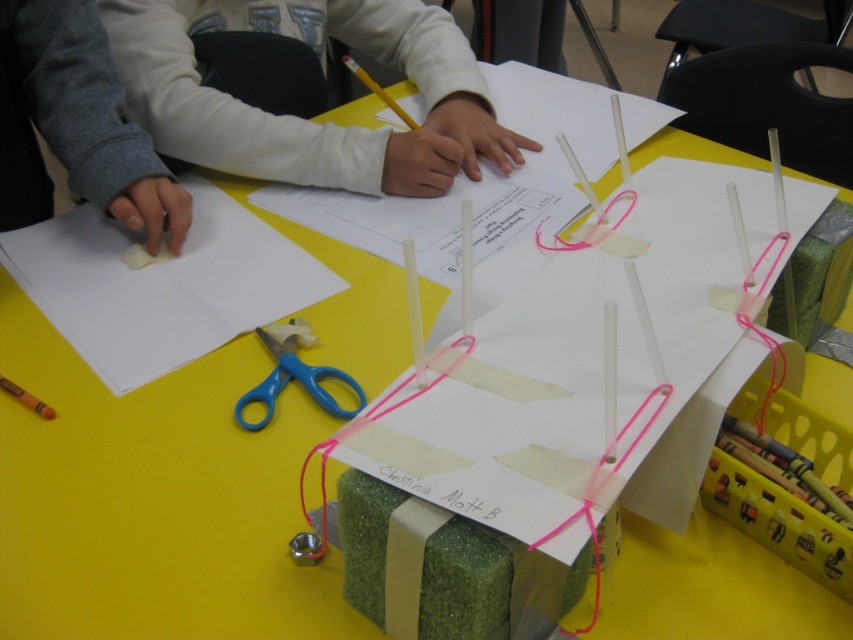
Is green matte foam at center bigger than blue plastic scissors at center?

Yes, green matte foam at center is bigger than blue plastic scissors at center.

Is green matte foam at center shorter than blue plastic scissors at center?

No.

Find the location of a particular element. Image resolution: width=853 pixels, height=640 pixels. green matte foam at center is located at coordinates (573, 362).

Image resolution: width=853 pixels, height=640 pixels. Find the location of `green matte foam at center`. green matte foam at center is located at coordinates (573, 362).

Between white paper at left and white paper at center, which one appears on the left side from the viewer's perspective?

From the viewer's perspective, white paper at left appears more on the left side.

Is point (109, 304) in front of point (642, 122)?

That is True.

Is point (68, 266) positioned before point (408, 198)?

Yes, point (68, 266) is in front of point (408, 198).

Find the location of a particular element. Image resolution: width=853 pixels, height=640 pixels. white paper at left is located at coordinates tap(161, 285).

Who is shorter, green matte foam at center or white paper at left?

With less height is white paper at left.

Is green matte foam at center below white paper at left?

Yes, green matte foam at center is below white paper at left.

Is point (755, 225) positioned after point (187, 284)?

No, it is not.

Identify the location of green matte foam at center. The height and width of the screenshot is (640, 853). (573, 362).